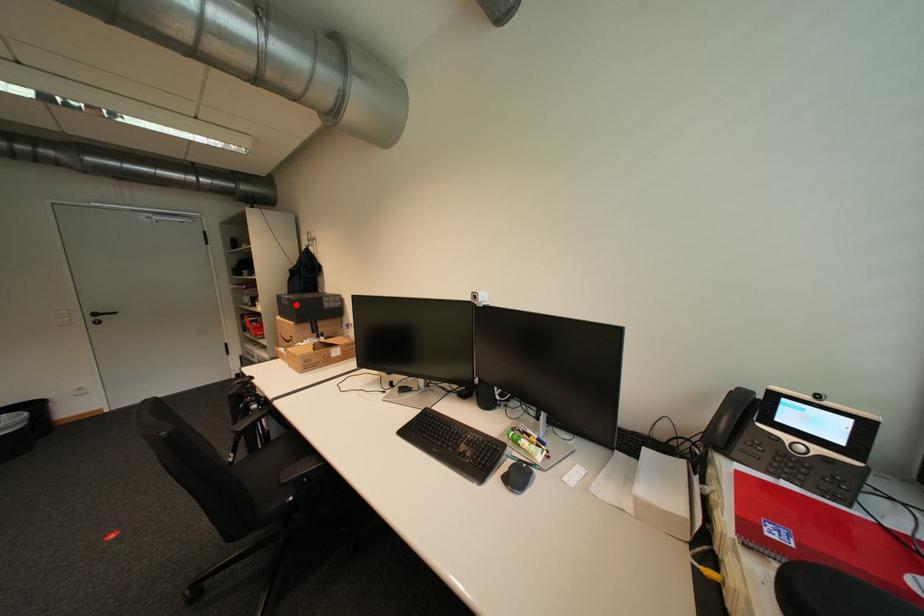
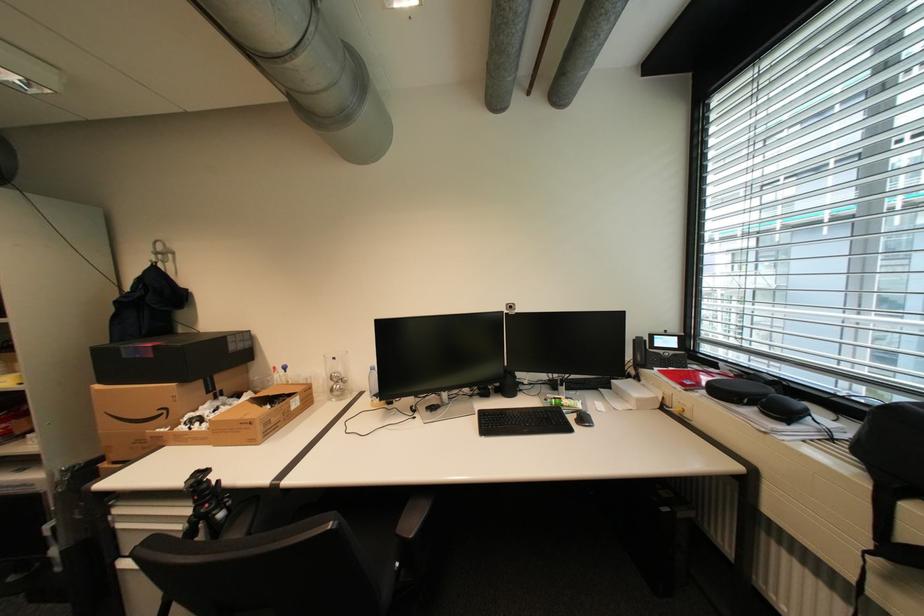
In the second image, find the point that corresponds to the highlighted location in the first image.

(161, 357)